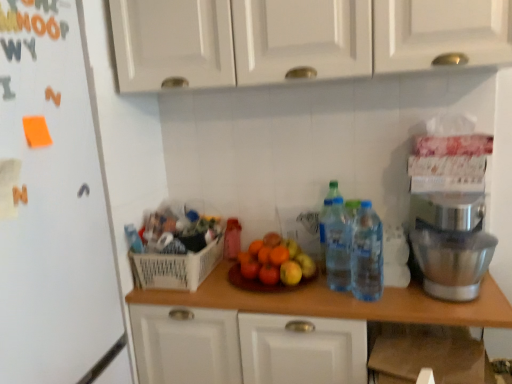
Question: Can you confirm if translucent plastic bottle at center, positioned as the 3th bottle in right-to-left order, is wider than wooden at center?

Choices:
 (A) yes
 (B) no

Answer: (B)

Question: Would you say translucent plastic bottle at center, positioned as the 3th bottle in right-to-left order, contains wooden at center?

Choices:
 (A) yes
 (B) no

Answer: (B)

Question: Considering the relative sizes of translucent plastic bottle at center, which is the 1th bottle in back-to-front order, and wooden at center in the image provided, is translucent plastic bottle at center, which is the 1th bottle in back-to-front order, shorter than wooden at center?

Choices:
 (A) no
 (B) yes

Answer: (B)

Question: Are translucent plastic bottle at center, the 1th bottle in the left-to-right sequence, and wooden at center making contact?

Choices:
 (A) yes
 (B) no

Answer: (B)

Question: Considering the relative positions of translucent plastic bottle at center, positioned as the 3th bottle in right-to-left order, and wooden at center in the image provided, is translucent plastic bottle at center, positioned as the 3th bottle in right-to-left order, behind wooden at center?

Choices:
 (A) yes
 (B) no

Answer: (A)

Question: Considering the relative sizes of translucent plastic bottle at center, the 1th bottle in the left-to-right sequence, and wooden at center in the image provided, is translucent plastic bottle at center, the 1th bottle in the left-to-right sequence, bigger than wooden at center?

Choices:
 (A) yes
 (B) no

Answer: (B)

Question: From a real-world perspective, is translucent plastic bottles at center right beneath wooden at center?

Choices:
 (A) yes
 (B) no

Answer: (B)

Question: Is translucent plastic bottles at center right behind wooden at center?

Choices:
 (A) no
 (B) yes

Answer: (B)

Question: Can you confirm if translucent plastic bottles at center right is positioned to the right of wooden at center?

Choices:
 (A) yes
 (B) no

Answer: (A)

Question: From the image's perspective, is translucent plastic bottles at center right above wooden at center?

Choices:
 (A) no
 (B) yes

Answer: (B)

Question: Can you confirm if translucent plastic bottles at center right is bigger than wooden at center?

Choices:
 (A) no
 (B) yes

Answer: (A)

Question: Is translucent plastic bottles at center right not inside wooden at center?

Choices:
 (A) no
 (B) yes

Answer: (B)

Question: Does translucent plastic bottles at center right have a smaller size compared to white plastic basket at center?

Choices:
 (A) no
 (B) yes

Answer: (B)